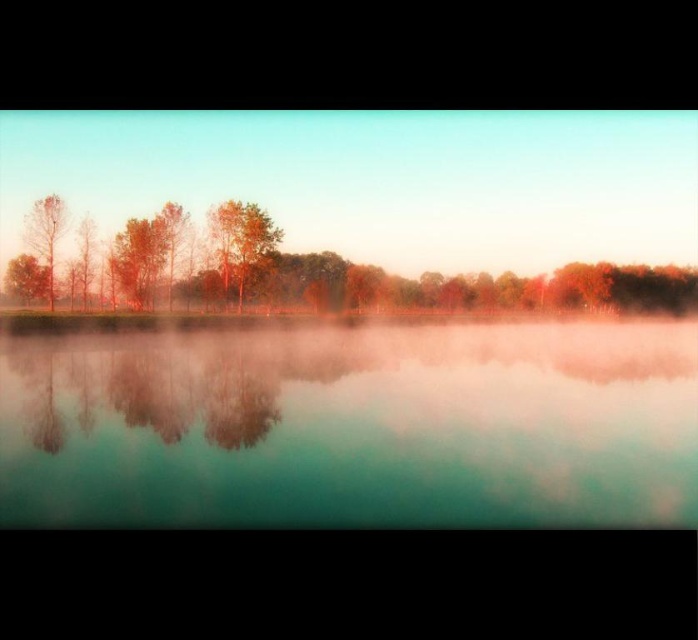
Question: Is translucent glass water at center wider than matte orange trees at center?

Choices:
 (A) no
 (B) yes

Answer: (A)

Question: Which object is farther from the camera taking this photo?

Choices:
 (A) smooth brown tree at left
 (B) matte orange trees at center

Answer: (B)

Question: Is the position of matte orange trees at center less distant than that of orange-brown textured tree at center?

Choices:
 (A) no
 (B) yes

Answer: (B)

Question: Observing the image, what is the correct spatial positioning of translucent glass water at center in reference to matte orange trees at center?

Choices:
 (A) left
 (B) right

Answer: (A)

Question: Which object appears closest to the camera in this image?

Choices:
 (A) orange-brown textured tree at center
 (B) smooth brown tree at left

Answer: (B)

Question: Among these points, which one is farthest from the camera?

Choices:
 (A) (43, 250)
 (B) (82, 289)
 (C) (644, 465)

Answer: (B)